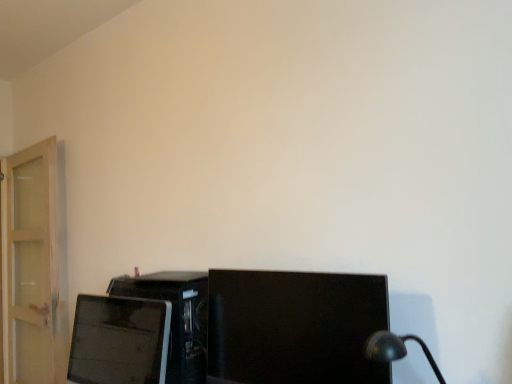
Question: From the image's perspective, is black glossy monitor at center, which appears as the first computer monitor when viewed from the right, positioned above or below matte black monitor at lower left, which is counted as the 2th computer monitor, starting from the right?

Choices:
 (A) above
 (B) below

Answer: (A)

Question: Is black glossy monitor at center, arranged as the 2th computer monitor when viewed from the left, wider or thinner than matte black monitor at lower left, marked as the 1th computer monitor in a left-to-right arrangement?

Choices:
 (A) wide
 (B) thin

Answer: (A)

Question: Which of these objects is positioned closest to the matte black desktop computer at lower left?

Choices:
 (A) black glossy monitor at center, arranged as the 2th computer monitor when viewed from the left
 (B) matte black monitor at lower left, marked as the 1th computer monitor in a left-to-right arrangement

Answer: (B)

Question: Based on their relative distances, which object is farther from the black glossy monitor at center, arranged as the 2th computer monitor when viewed from the left?

Choices:
 (A) matte black monitor at lower left, marked as the 1th computer monitor in a left-to-right arrangement
 (B) matte black desktop computer at lower left

Answer: (A)